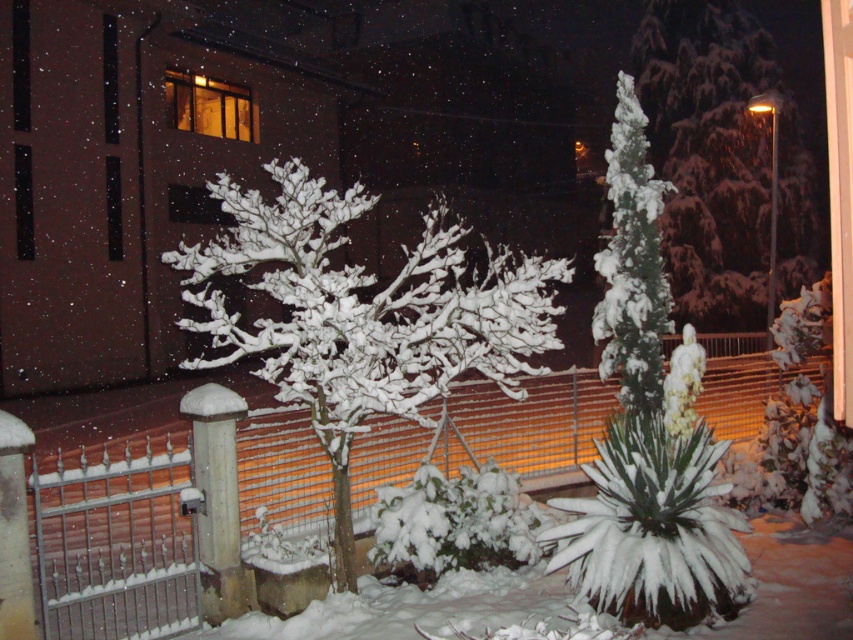
Question: Does metallic wire fence at center appear over snow-covered branches at center?

Choices:
 (A) no
 (B) yes

Answer: (A)

Question: Which object appears farthest from the camera in this image?

Choices:
 (A) white fluffy tree at right
 (B) metallic wire fence at center

Answer: (A)

Question: Which point appears closest to the camera in this image?

Choices:
 (A) (387, 381)
 (B) (722, 90)

Answer: (A)

Question: Estimate the real-world distances between objects in this image. Which object is closer to the metallic wire fence at center?

Choices:
 (A) white fluffy tree at right
 (B) snow-covered evergreen at upper right
 (C) snow-covered branches at center

Answer: (C)

Question: Can you confirm if snow-covered evergreen at upper right is wider than white fluffy tree at right?

Choices:
 (A) yes
 (B) no

Answer: (A)

Question: Where is snow-covered branches at center located in relation to white fluffy tree at right in the image?

Choices:
 (A) left
 (B) right

Answer: (A)